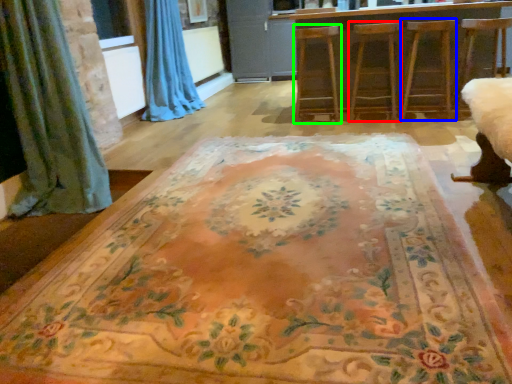
Question: Which is farther away from armchair (highlighted by a red box)? armchair (highlighted by a blue box) or armchair (highlighted by a green box)?

Choices:
 (A) armchair
 (B) armchair

Answer: (B)